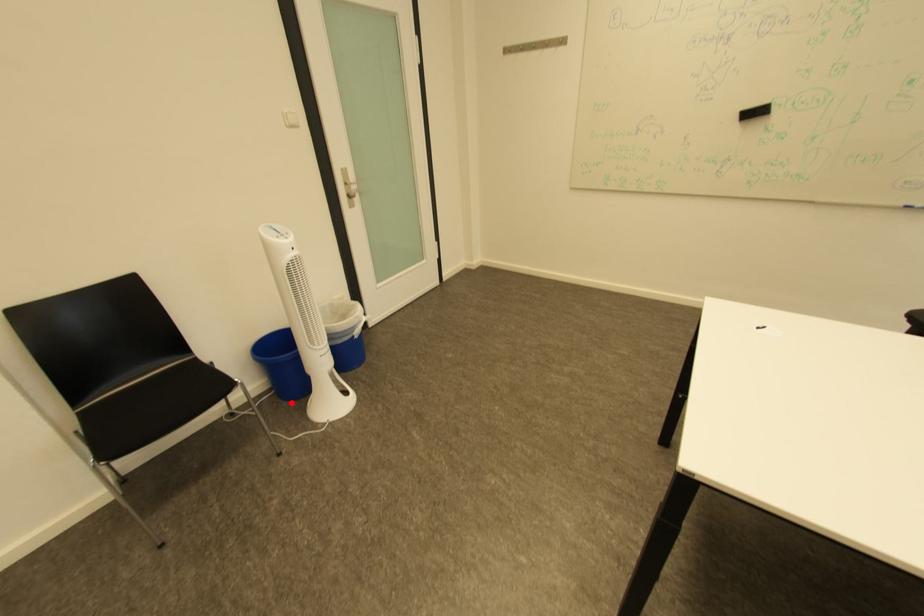
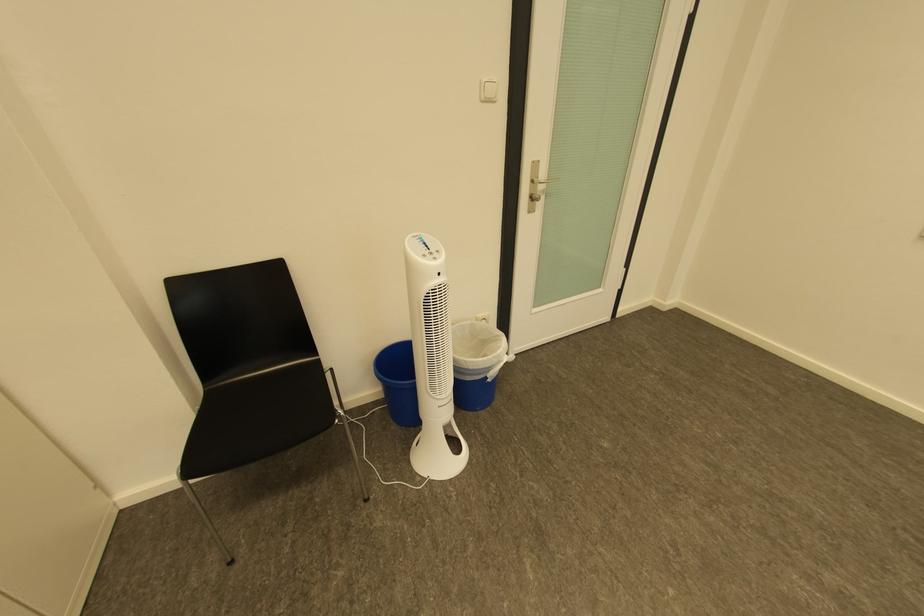
Question: I am providing you with two images of the same scene from different viewpoints. Given a red point in image1, look at the same physical point in image2. Is it:

Choices:
 (A) Closer to the viewpoint
 (B) Farther from the viewpoint

Answer: (B)